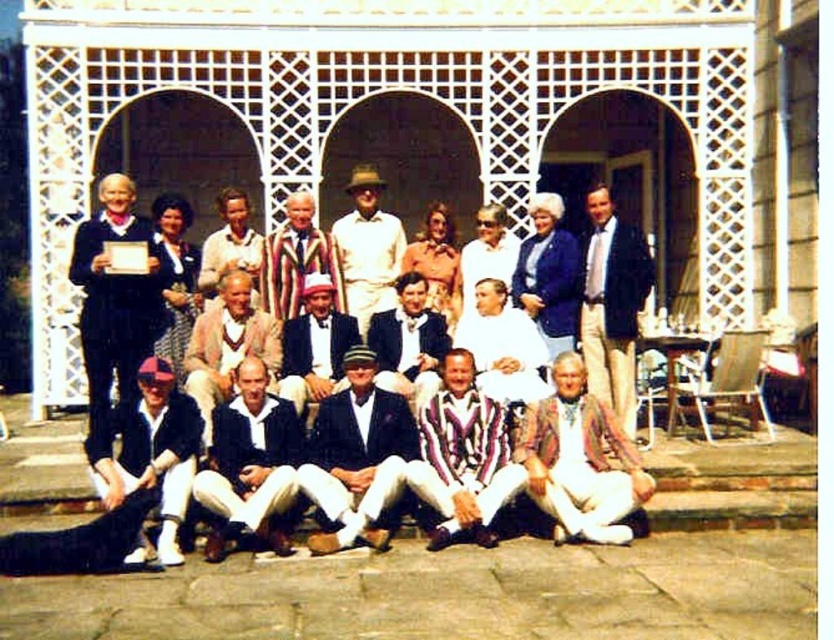
You are a costume designer preparing for a historical drama. You have two garments to place on a mannequin for a scene set in the 1950s. The garments are the striped wool sweater at lower center and the white cotton shirt at center. Which garment should you choose if you want the mannequin to have a more compact appearance?

The striped wool sweater at lower center has a smaller size compared to the white cotton shirt at center, so choosing the striped wool sweater at lower center will give the mannequin a more compact appearance.

What are the coordinates of the blue woolen sweater at center?

The blue woolen sweater at center is located at coordinates point (548, 275).